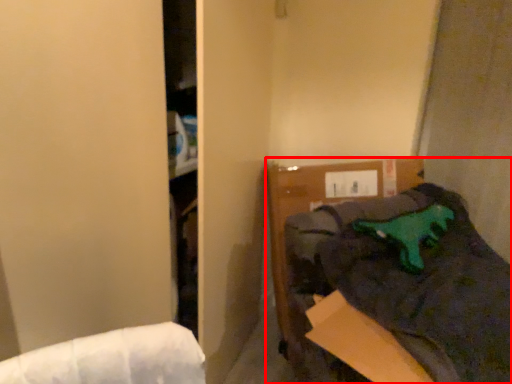
Question: Where is furniture (annotated by the red box) located in relation to animal in the image?

Choices:
 (A) right
 (B) left

Answer: (A)